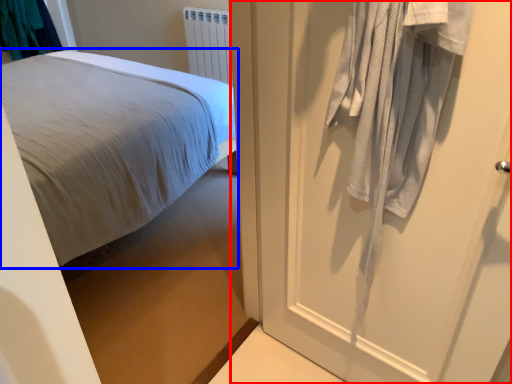
Question: Which object appears closest to the camera in this image, door (highlighted by a red box) or bed (highlighted by a blue box)?

Choices:
 (A) door
 (B) bed

Answer: (A)